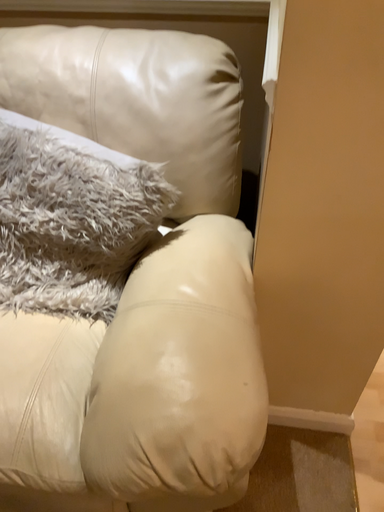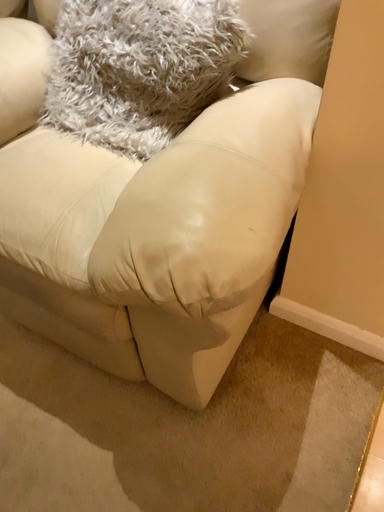
Question: How did the camera likely rotate when shooting the video?

Choices:
 (A) rotated upward
 (B) rotated downward

Answer: (B)